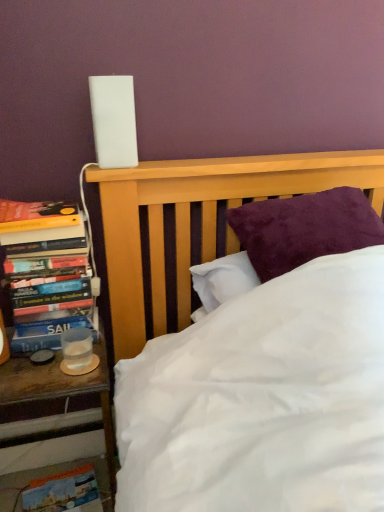
Image resolution: width=384 pixels, height=512 pixels. In order to click on clear plastic cup at left in this screenshot , I will do `click(78, 352)`.

This screenshot has height=512, width=384. Identify the location of hardcover books at left. point(46,273).

At what (x,y) coordinates should I click in order to perform the action: click on clear plastic cup at left. Please return your answer as a coordinate pair (x, y). The width and height of the screenshot is (384, 512). Looking at the image, I should click on (78, 352).

How many degrees apart are the facing directions of hardcover books at left and wooden nightstand at left?

The facing directions of hardcover books at left and wooden nightstand at left are 0.00217 degrees apart.

From a real-world perspective, between hardcover books at left and wooden nightstand at left, who is vertically lower?

From a 3D spatial view, wooden nightstand at left is below.

Does hardcover books at left have a lesser width compared to wooden nightstand at left?

Indeed, hardcover books at left has a lesser width compared to wooden nightstand at left.

The height and width of the screenshot is (512, 384). In order to click on book to the right of wooden nightstand at left in this screenshot , I will do `click(46, 273)`.

From the picture: Is wooden nightstand at left wider or thinner than hardcover books at left?

In the image, wooden nightstand at left appears to be wider than hardcover books at left.

Does wooden nightstand at left have a smaller size compared to hardcover books at left?

Incorrect, wooden nightstand at left is not smaller in size than hardcover books at left.

Is the position of wooden nightstand at left more distant than that of hardcover books at left?

No, the depth of wooden nightstand at left is less than that of hardcover books at left.

Based on the photo, considering the positions of objects wooden nightstand at left and hardcover books at left in the image provided, who is more to the left, wooden nightstand at left or hardcover books at left?

From the viewer's perspective, wooden nightstand at left appears more on the left side.

Is wooden nightstand at left positioned in front of clear plastic cup at left?

Yes, wooden nightstand at left is closer to the viewer.

Consider the image. Is clear plastic cup at left inside wooden nightstand at left?

Yes, clear plastic cup at left is a part of wooden nightstand at left.

Which object is wider, wooden nightstand at left or clear plastic cup at left?

With larger width is wooden nightstand at left.

Is wooden nightstand at left oriented away from clear plastic cup at left?

wooden nightstand at left does not have its back to clear plastic cup at left.

Is clear plastic cup at left not close to hardcover books at left?

That's not correct — clear plastic cup at left is a little close to hardcover books at left.

Choose the correct answer: Is clear plastic cup at left inside hardcover books at left or outside it?

clear plastic cup at left exists outside the volume of hardcover books at left.

Is clear plastic cup at left to the right of hardcover books at left from the viewer's perspective?

Correct, you'll find clear plastic cup at left to the right of hardcover books at left.

Does point (70, 344) come behind point (78, 310)?

No.

Considering the sizes of objects hardcover books at left and clear plastic cup at left in the image provided, who is shorter, hardcover books at left or clear plastic cup at left?

Standing shorter between the two is clear plastic cup at left.

Can you tell me how much hardcover books at left and clear plastic cup at left differ in facing direction?

The facing directions of hardcover books at left and clear plastic cup at left are 0.175 degrees apart.

From a real-world perspective, relative to clear plastic cup at left, is hardcover books at left vertically above or below?

hardcover books at left is above clear plastic cup at left.

From the picture: Considering the sizes of clear plastic cup at left and wooden nightstand at left in the image, is clear plastic cup at left taller or shorter than wooden nightstand at left?

Clearly, clear plastic cup at left is shorter compared to wooden nightstand at left.

Is wooden nightstand at left at the back of clear plastic cup at left?

No, clear plastic cup at left's orientation is not away from wooden nightstand at left.

Locate an element on the screen. The height and width of the screenshot is (512, 384). book to the right of wooden nightstand at left is located at coordinates (46, 273).

Locate an element on the screen. nightstand below the hardcover books at left (from the image's perspective) is located at coordinates (61, 391).

Estimate the real-world distances between objects in this image. Which object is further from wooden nightstand at left, hardcover books at left or clear plastic cup at left?

hardcover books at left lies further to wooden nightstand at left than the other object.

Considering their positions, is wooden nightstand at left positioned closer to hardcover books at left than clear plastic cup at left?

Among the two, clear plastic cup at left is located nearer to hardcover books at left.

Estimate the real-world distances between objects in this image. Which object is further from hardcover books at left, clear plastic cup at left or wooden nightstand at left?

The object further to hardcover books at left is wooden nightstand at left.

Looking at the image, which one is located further to clear plastic cup at left, wooden nightstand at left or hardcover books at left?

Based on the image, hardcover books at left appears to be further to clear plastic cup at left.

Considering their positions, is clear plastic cup at left positioned further to wooden nightstand at left than hardcover books at left?

Among the two, hardcover books at left is located further to wooden nightstand at left.

Looking at the image, which one is located closer to clear plastic cup at left, hardcover books at left or wooden nightstand at left?

wooden nightstand at left is positioned closer to the anchor clear plastic cup at left.

This screenshot has width=384, height=512. Find the location of `candle holder between hardcover books at left and wooden nightstand at left in the vertical direction`. candle holder between hardcover books at left and wooden nightstand at left in the vertical direction is located at coordinates (78, 352).